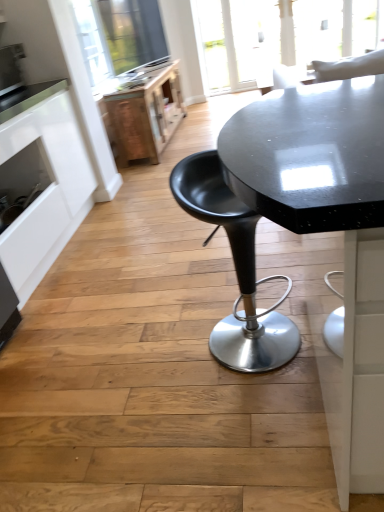
Where is `black plastic stool at center`? The height and width of the screenshot is (512, 384). black plastic stool at center is located at coordinates (235, 270).

At what (x,y) coordinates should I click in order to perform the action: click on black plastic stool at center. Please return your answer as a coordinate pair (x, y). Looking at the image, I should click on (235, 270).

Considering the positions of objects wooden file cabinet at upper left and satin silver toaster at upper left in the image provided, who is in front, wooden file cabinet at upper left or satin silver toaster at upper left?

satin silver toaster at upper left is closer to the camera.

Can you confirm if wooden file cabinet at upper left is wider than satin silver toaster at upper left?

Indeed, wooden file cabinet at upper left has a greater width compared to satin silver toaster at upper left.

Which object is positioned more to the left, wooden file cabinet at upper left or satin silver toaster at upper left?

Positioned to the left is satin silver toaster at upper left.

Consider the image. From a real-world perspective, is satin silver toaster at upper left located beneath black plastic stool at center?

No.

Is satin silver toaster at upper left in contact with black plastic stool at center?

satin silver toaster at upper left is not next to black plastic stool at center, and they're not touching.

Between satin silver toaster at upper left and black plastic stool at center, which one has more height?

black plastic stool at center.

From the image's perspective, is satin silver toaster at upper left below white matte cabinet at left?

No.

Which is behind, satin silver toaster at upper left or white matte cabinet at left?

satin silver toaster at upper left.

Would you consider satin silver toaster at upper left to be distant from white matte cabinet at left?

No, satin silver toaster at upper left is not far away from white matte cabinet at left.

Is satin silver toaster at upper left inside the boundaries of white matte cabinet at left, or outside?

satin silver toaster at upper left is not enclosed by white matte cabinet at left.

Is wooden file cabinet at upper left surrounded by white matte cabinet at left?

No, white matte cabinet at left does not contain wooden file cabinet at upper left.

Is white matte cabinet at left behind wooden file cabinet at upper left?

No.

Is white matte cabinet at left beside wooden file cabinet at upper left?

white matte cabinet at left is not next to wooden file cabinet at upper left, and they're not touching.

From a real-world perspective, is black plastic stool at center on top of satin silver toaster at upper left?

Actually, black plastic stool at center is physically below satin silver toaster at upper left in the real world.

Is black plastic stool at center beside satin silver toaster at upper left?

No.

Consider the image. Is black plastic stool at center facing towards satin silver toaster at upper left?

No, black plastic stool at center is not turned towards satin silver toaster at upper left.

Which of these two, black plastic stool at center or wooden file cabinet at upper left, is thinner?

black plastic stool at center.

From a real-world perspective, is black plastic stool at center on top of wooden file cabinet at upper left?

Yes, from a real-world perspective, black plastic stool at center is above wooden file cabinet at upper left.

Can you tell me how much black plastic stool at center and wooden file cabinet at upper left differ in facing direction?

37 degrees.

Based on the photo, who is shorter, black plastic stool at center or wooden file cabinet at upper left?

Standing shorter between the two is wooden file cabinet at upper left.

Is white matte cabinet at left next to black plastic stool at center and touching it?

white matte cabinet at left and black plastic stool at center are clearly separated.

Is black plastic stool at center surrounded by white matte cabinet at left?

No, black plastic stool at center is located outside of white matte cabinet at left.

The image size is (384, 512). Find the location of `chair lying in front of the white matte cabinet at left`. chair lying in front of the white matte cabinet at left is located at coordinates (235, 270).

Where is `appliance on the left of wooden file cabinet at upper left`? This screenshot has width=384, height=512. appliance on the left of wooden file cabinet at upper left is located at coordinates (10, 68).

You are a GUI agent. You are given a task and a screenshot of the screen. Output one action in this format:
    pyautogui.click(x=<x>, y=<y>)
    Task: Click on the chair on the right of satin silver toaster at upper left
    Image resolution: width=384 pixels, height=512 pixels.
    Given the screenshot: What is the action you would take?
    pyautogui.click(x=235, y=270)

Estimate the real-world distances between objects in this image. Which object is closer to satin silver toaster at upper left, black plastic stool at center or white matte cabinet at left?

Based on the image, white matte cabinet at left appears to be nearer to satin silver toaster at upper left.

Based on their spatial positions, is satin silver toaster at upper left or black plastic stool at center closer to wooden file cabinet at upper left?

Among the two, satin silver toaster at upper left is located nearer to wooden file cabinet at upper left.

Considering their positions, is white matte cabinet at left positioned further to satin silver toaster at upper left than black plastic stool at center?

black plastic stool at center.

Which object lies nearer to the anchor point white matte cabinet at left, black plastic stool at center or wooden file cabinet at upper left?

black plastic stool at center lies closer to white matte cabinet at left than the other object.

Looking at the image, which one is located closer to black plastic stool at center, white matte cabinet at left or satin silver toaster at upper left?

Based on the image, white matte cabinet at left appears to be nearer to black plastic stool at center.

Estimate the real-world distances between objects in this image. Which object is further from white matte cabinet at left, wooden file cabinet at upper left or satin silver toaster at upper left?

wooden file cabinet at upper left is positioned further to the anchor white matte cabinet at left.

When comparing their distances from black plastic stool at center, does wooden file cabinet at upper left or satin silver toaster at upper left seem further?

wooden file cabinet at upper left is further to black plastic stool at center.

Estimate the real-world distances between objects in this image. Which object is further from white matte cabinet at left, satin silver toaster at upper left or black plastic stool at center?

black plastic stool at center is positioned further to the anchor white matte cabinet at left.

The height and width of the screenshot is (512, 384). Find the location of `cabinetry between black plastic stool at center and wooden file cabinet at upper left in the front-back direction`. cabinetry between black plastic stool at center and wooden file cabinet at upper left in the front-back direction is located at coordinates (41, 181).

Find the location of a particular element. The width and height of the screenshot is (384, 512). appliance between black plastic stool at center and wooden file cabinet at upper left from front to back is located at coordinates (10, 68).

Where is `appliance located between white matte cabinet at left and wooden file cabinet at upper left in the depth direction`? This screenshot has height=512, width=384. appliance located between white matte cabinet at left and wooden file cabinet at upper left in the depth direction is located at coordinates (10, 68).

Where is `cabinetry between satin silver toaster at upper left and black plastic stool at center from left to right`? This screenshot has height=512, width=384. cabinetry between satin silver toaster at upper left and black plastic stool at center from left to right is located at coordinates (41, 181).